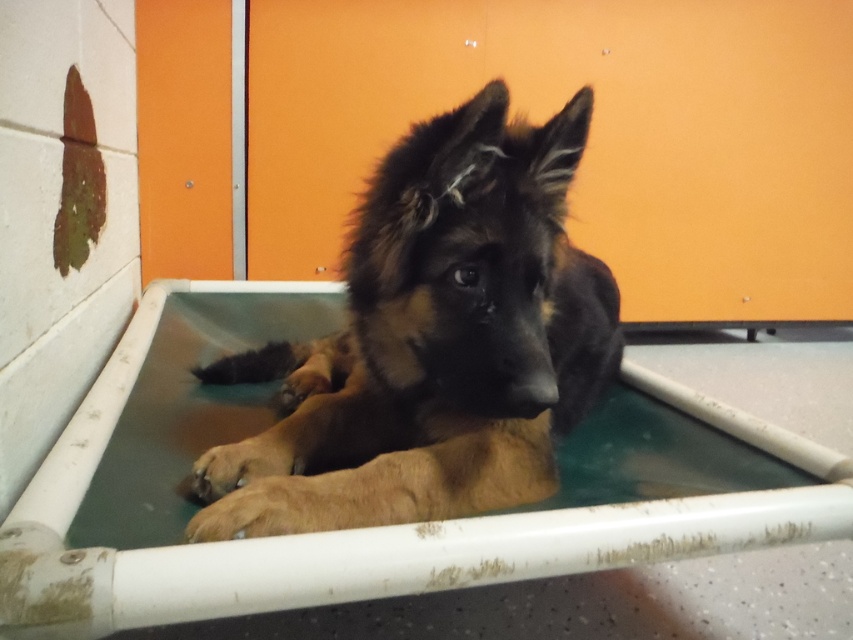
You are a volunteer at an animal shelter and need to determine if there is enough space in the green plastic bath at center for the brown fur dog at center to move comfortably. Based on the scene, can the dog move around freely in the bath?

The brown fur dog at center occupies less space than the green plastic bath at center, so yes, the dog has enough space to move around comfortably in the bath.

You are standing in front of the enclosure with the German Shepherd puppy. There are two points marked on the wall behind the enclosure. One is at coordinate point (555, 154) and the other at point (517, 556). From your perspective, which point is closer to you?

Point (517, 556) is closer to you because according to the description, point (555, 154) is behind point (517, 556), meaning it is farther away from your viewpoint.

You are a veterinarian examining a German Shepherd puppy in an enclosure. The enclosure has a green plastic bath at center and a brown fur dog at center. Based on the scene, which object is taller?

The brown fur dog at center is taller than the green plastic bath at center.